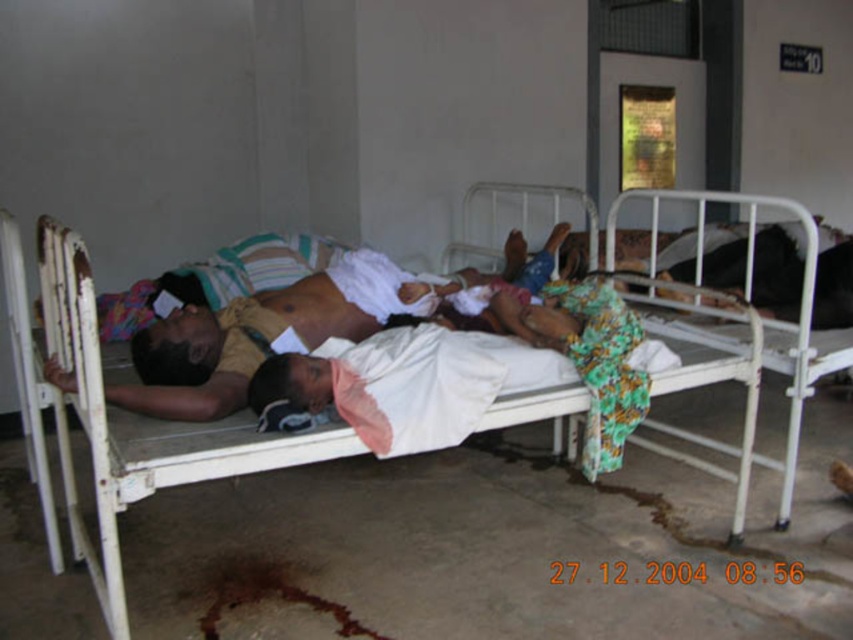
Looking at this image, you are a nurse in a hospital ward. You need to check on the patient lying on the white metal bed at center and the person covered by the light brown fabric shirt at center. Which patient is closer to the entrance of the ward?

The white metal bed at center is positioned on the left side of the light brown fabric shirt at center. Since the entrance is typically located on the left side of a hospital ward, the patient on the white metal bed at center is closer to the entrance.